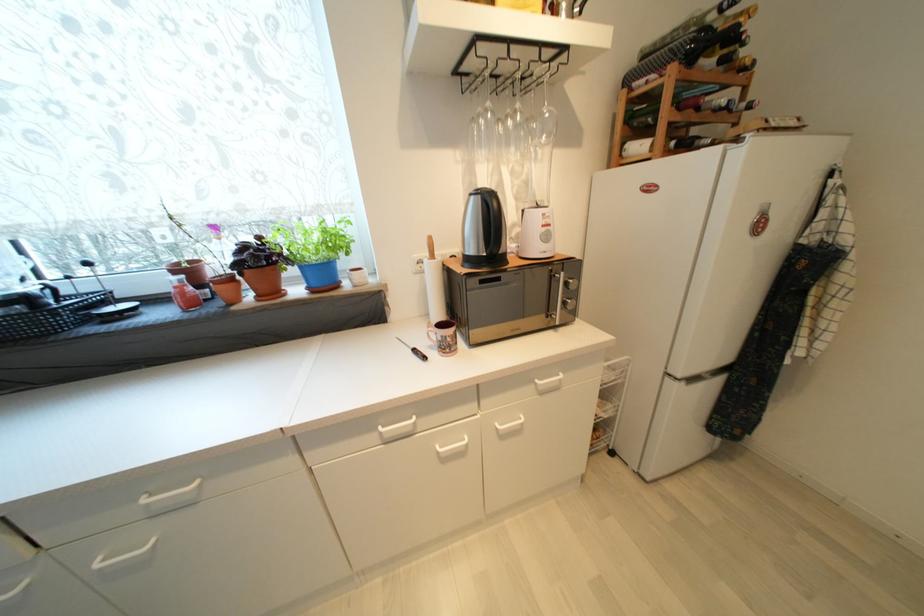
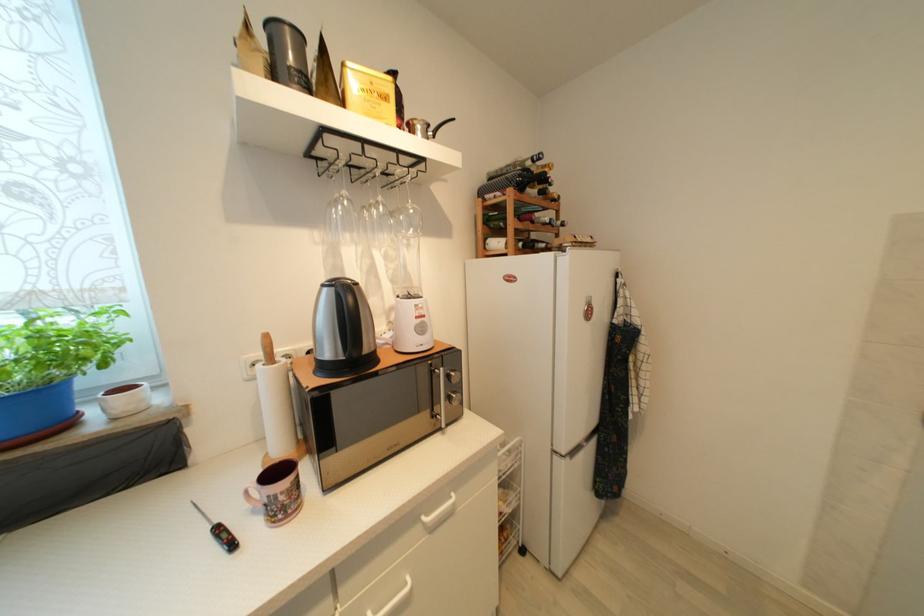
Find the pixel in the second image that matches pixel 341 245 in the first image.

(77, 353)